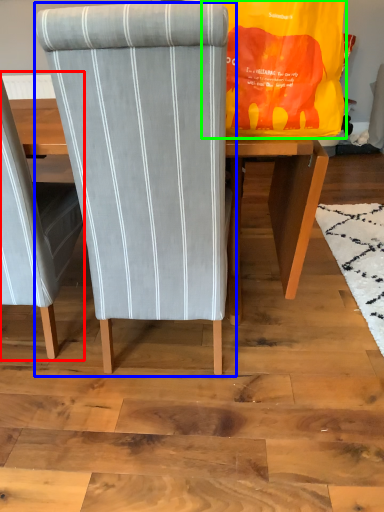
Question: Which is farther away from chair (highlighted by a red box)? chair (highlighted by a blue box) or bag (highlighted by a green box)?

Choices:
 (A) chair
 (B) bag

Answer: (B)